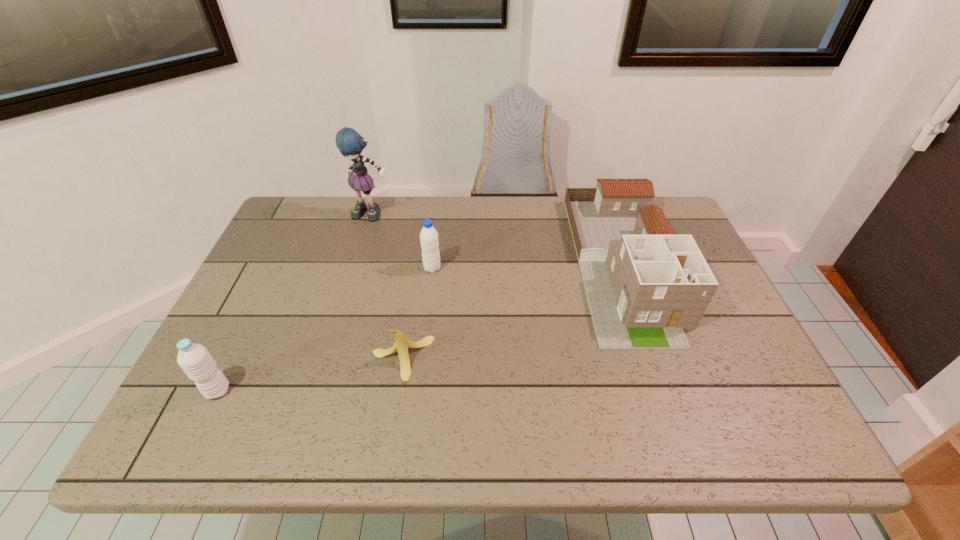
Where is `vacant space that is in between the tallest object and the nearer water bottle`? The image size is (960, 540). vacant space that is in between the tallest object and the nearer water bottle is located at coordinates (296, 303).

The height and width of the screenshot is (540, 960). What are the coordinates of `unoccupied area between the tallest object and the farther water bottle` in the screenshot? It's located at (402, 241).

You are a GUI agent. You are given a task and a screenshot of the screen. Output one action in this format:
    pyautogui.click(x=<x>, y=<y>)
    Task: Click on the vacant area that lies between the banana and the right water bottle
    
    Given the screenshot: What is the action you would take?
    pyautogui.click(x=417, y=314)

The width and height of the screenshot is (960, 540). What are the coordinates of `the second closest object relative to the shortest object` in the screenshot? It's located at (195, 360).

In order to click on object identified as the third closest to the rightmost object in this screenshot , I will do `click(350, 143)`.

Find the location of a particular element. This screenshot has height=540, width=960. free space that satisfies the following two spatial constraints: 1. on the front-facing side of the rag doll; 2. on the right side of the right water bottle is located at coordinates (357, 268).

This screenshot has height=540, width=960. In order to click on vacant space that satisfies the following two spatial constraints: 1. on the front-facing side of the tallest object; 2. on the left side of the banana in this screenshot , I will do `click(330, 359)`.

Where is `vacant space that satisfies the following two spatial constraints: 1. on the front-facing side of the shortest object; 2. on the right side of the rag doll`? vacant space that satisfies the following two spatial constraints: 1. on the front-facing side of the shortest object; 2. on the right side of the rag doll is located at coordinates (330, 359).